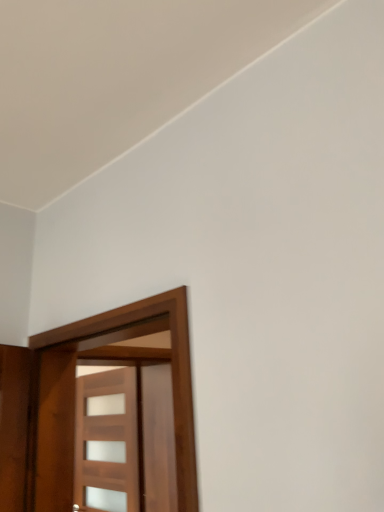
Question: Is wooden door at left, which is the 2th door in back-to-front order, bigger or smaller than wooden door at center, positioned as the 2th door in front-to-back order?

Choices:
 (A) big
 (B) small

Answer: (A)

Question: Considering the positions of wooden door at left, which is the 2th door in back-to-front order, and wooden door at center, which ranks as the 1th door in back-to-front order, in the image, is wooden door at left, which is the 2th door in back-to-front order, wider or thinner than wooden door at center, which ranks as the 1th door in back-to-front order,?

Choices:
 (A) wide
 (B) thin

Answer: (A)

Question: Is wooden door at left, which is the 2th door in back-to-front order, in front of or behind wooden door at center, which ranks as the 1th door in back-to-front order, in the image?

Choices:
 (A) behind
 (B) front

Answer: (B)

Question: From a real-world perspective, is wooden door at center, which ranks as the 1th door in back-to-front order, above or below wooden door at left, which is the 1th door from front to back?

Choices:
 (A) above
 (B) below

Answer: (B)

Question: Is wooden door at center, positioned as the 2th door in front-to-back order, bigger or smaller than wooden door at left, which is the 1th door from front to back?

Choices:
 (A) small
 (B) big

Answer: (A)

Question: Based on their positions, is wooden door at center, positioned as the 2th door in front-to-back order, located to the left or right of wooden door at left, which is the 1th door from front to back?

Choices:
 (A) left
 (B) right

Answer: (A)

Question: Which is correct: wooden door at center, which ranks as the 1th door in back-to-front order, is inside wooden door at left, which is the 2th door in back-to-front order, or outside of it?

Choices:
 (A) outside
 (B) inside

Answer: (A)